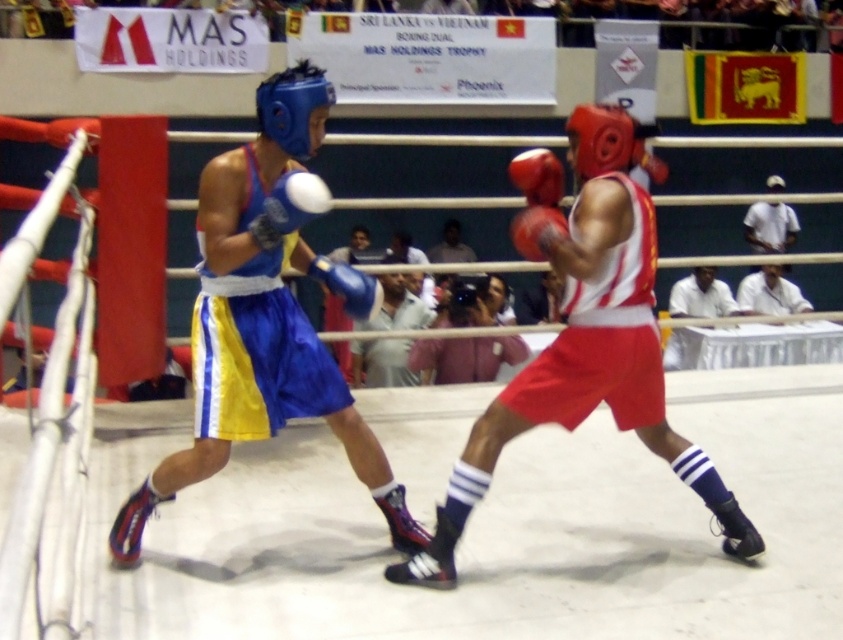
You are a photographer standing at the edge of the boxing ring. You want to take a photo of both the light gray cotton shirt at center and the white fabric shirt at upper right in the same frame. Given that your camera has a maximum focus range of 6 meters, will you be able to capture both shirts in focus?

The light gray cotton shirt at center and the white fabric shirt at upper right are 6.69 meters apart, which exceeds the camera maximum focus range of 6 meters. Therefore, you cannot capture both shirts in focus.

You are a referee in the boxing match and need to determine if the blue synthetic boxing glove at upper center is taller than the blue fabric shorts at center. Based on the scene, what is your observation?

The blue synthetic boxing glove at upper center has a lesser height compared to the blue fabric shorts at center, so it is not taller.

You are a referee watching the boxing match. You notice the red matte boxing glove at center and the blue synthetic boxing glove at upper center. Which glove is closer to the front of the ring?

The red matte boxing glove at center is closer to the front of the ring because the blue synthetic boxing glove at upper center is behind it.